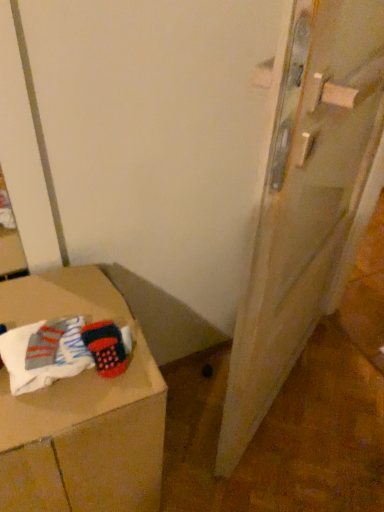
Question: Is cardboard box at lower left situated inside wooden door at right or outside?

Choices:
 (A) inside
 (B) outside

Answer: (B)

Question: In terms of width, does cardboard box at lower left look wider or thinner when compared to wooden door at right?

Choices:
 (A) thin
 (B) wide

Answer: (B)

Question: Based on their relative distances, which object is nearer to the white cotton socks at lower left?

Choices:
 (A) wooden door at right
 (B) cardboard box at lower left

Answer: (B)

Question: Estimate the real-world distances between objects in this image. Which object is farther from the cardboard box at lower left?

Choices:
 (A) wooden door at right
 (B) white cotton socks at lower left

Answer: (A)